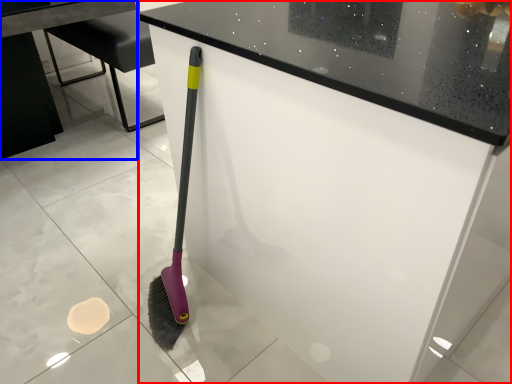
Question: Which of the following is the farthest to the observer, counter (highlighted by a red box) or table (highlighted by a blue box)?

Choices:
 (A) counter
 (B) table

Answer: (B)